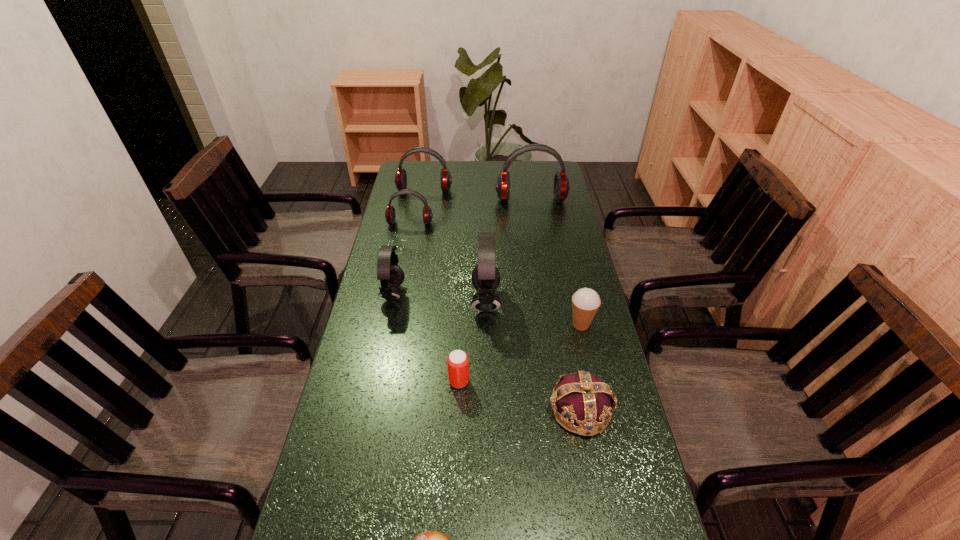
Locate an element on the screen. The width and height of the screenshot is (960, 540). vacant space that satisfies the following two spatial constraints: 1. on the ear cups of the third nearest earphone; 2. on the left side of the crown is located at coordinates (372, 410).

Where is `vacant point that satisfies the following two spatial constraints: 1. on the ear cups of the icecream; 2. on the left side of the second smallest red earphone`? The image size is (960, 540). vacant point that satisfies the following two spatial constraints: 1. on the ear cups of the icecream; 2. on the left side of the second smallest red earphone is located at coordinates (400, 325).

Image resolution: width=960 pixels, height=540 pixels. I want to click on blank area in the image that satisfies the following two spatial constraints: 1. on the ear cups of the left black earphone; 2. on the back side of the red beer can, so click(x=374, y=381).

Locate an element on the screen. Image resolution: width=960 pixels, height=540 pixels. vacant region that satisfies the following two spatial constraints: 1. on the ear cups of the icecream; 2. on the left side of the left black earphone is located at coordinates (387, 325).

Find the location of a particular element. blank area in the image that satisfies the following two spatial constraints: 1. on the ear cups of the biggest red earphone; 2. on the right side of the icecream is located at coordinates (551, 325).

The width and height of the screenshot is (960, 540). What are the coordinates of `free point that satisfies the following two spatial constraints: 1. on the ear cups of the icecream; 2. on the left side of the smaller black earphone` in the screenshot? It's located at (387, 325).

The image size is (960, 540). Find the location of `vacant space that satisfies the following two spatial constraints: 1. on the ear cups of the bigger black earphone; 2. on the right side of the purple crown`. vacant space that satisfies the following two spatial constraints: 1. on the ear cups of the bigger black earphone; 2. on the right side of the purple crown is located at coordinates (488, 410).